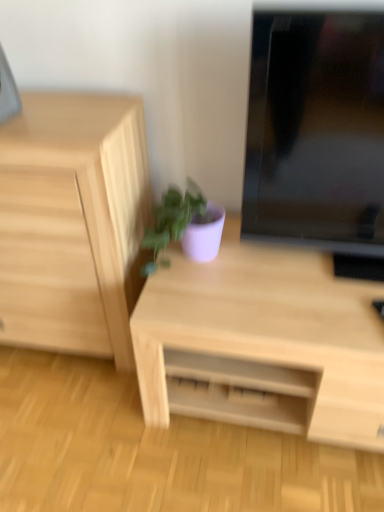
At what (x,y) coordinates should I click in order to perform the action: click on free region under matte purple pot at center (from a real-world perspective). Please return your answer as a coordinate pair (x, y). The height and width of the screenshot is (512, 384). Looking at the image, I should click on (180, 264).